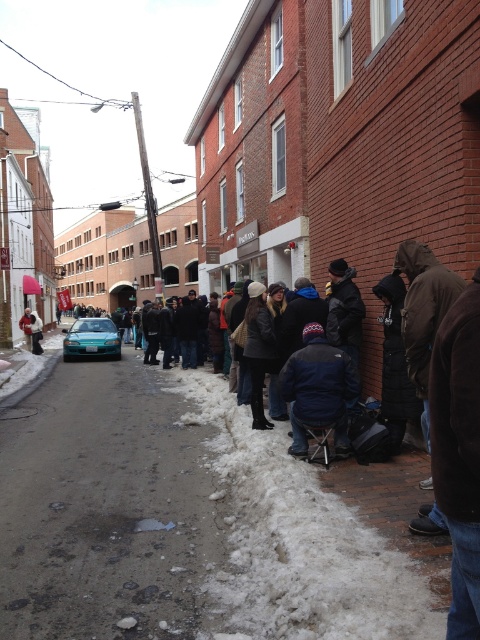
Question: Is white fluffy snow at lower center wider than teal matte car at lower left?

Choices:
 (A) no
 (B) yes

Answer: (A)

Question: Which of the following is the farthest from the observer?

Choices:
 (A) (98, 336)
 (B) (295, 449)
 (C) (344, 598)
 (D) (27, 321)

Answer: (D)

Question: Among these points, which one is farthest from the camera?

Choices:
 (A) (32, 323)
 (B) (103, 332)

Answer: (A)

Question: Does porous asphalt road at lower center have a lesser width compared to teal matte car at lower left?

Choices:
 (A) yes
 (B) no

Answer: (A)

Question: Observing the image, what is the correct spatial positioning of porous asphalt road at lower center in reference to dark blue fleece jacket at center?

Choices:
 (A) below
 (B) above

Answer: (A)

Question: Which object is farther from the camera taking this photo?

Choices:
 (A) dark blue fleece jacket at center
 (B) white wool coat at lower left
 (C) porous asphalt road at lower center
 (D) teal matte car at lower left

Answer: (B)